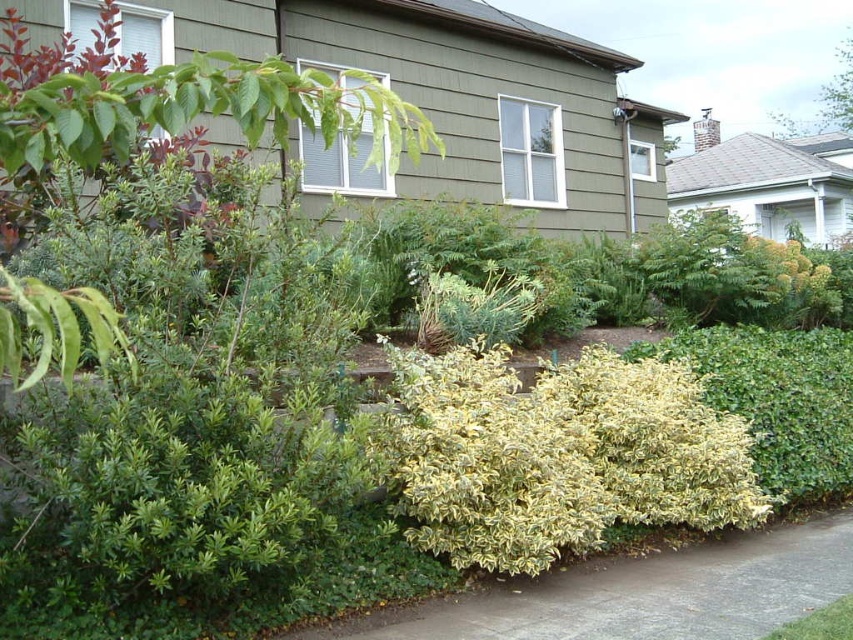
You are standing on the gray concrete pavement at lower center and want to look up to see the green leafy tree at upper left. Is the tree visible from your current position?

The green leafy tree at upper left is located above the gray concrete pavement at lower center, so yes, the tree is visible from your current position on the gray concrete pavement at lower center.

You are standing at the edge of the gray concrete pavement at lower center and want to reach the green leafy bush at upper center. Which direction should you move to get there?

You should move upward from the gray concrete pavement at lower center to reach the green leafy bush at upper center since it is located above it.

You are planning to install a new garden path that needs to be wider than the green leafy bush at upper center. Based on the scene, can the gray concrete pavement at lower center accommodate this requirement?

The gray concrete pavement at lower center has a width that surpasses the green leafy bush at upper center, so yes, it can accommodate a garden path wider than the green leafy bush at upper center.